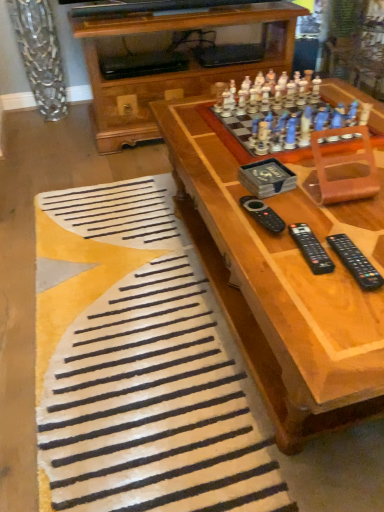
Question: In terms of height, does wooden chess set at center look taller or shorter compared to black plastic remote at center, which is counted as the 1th remote, starting from the left?

Choices:
 (A) tall
 (B) short

Answer: (A)

Question: Relative to black plastic remote at center, arranged as the 3th remote when viewed from the right, is wooden chess set at center in front or behind?

Choices:
 (A) behind
 (B) front

Answer: (B)

Question: Considering the real-world distances, which object is farthest from the wooden chess set at upper right?

Choices:
 (A) black plastic remote at lower right, the 3th remote viewed from the left
 (B) white soft rug at lower center
 (C) black plastic remote at center, arranged as the 3th remote when viewed from the right
 (D) wooden chess set at center
 (E) black plastic remote at lower right, acting as the 2th remote starting from the right

Answer: (B)

Question: Considering the real-world distances, which object is farthest from the black plastic remote at lower right, the 3th remote viewed from the left?

Choices:
 (A) white soft rug at lower center
 (B) wooden chess set at center
 (C) black plastic remote at lower right, which ranks as the second remote in left-to-right order
 (D) wooden chess set at upper right
 (E) black plastic remote at center, which is counted as the 1th remote, starting from the left

Answer: (A)